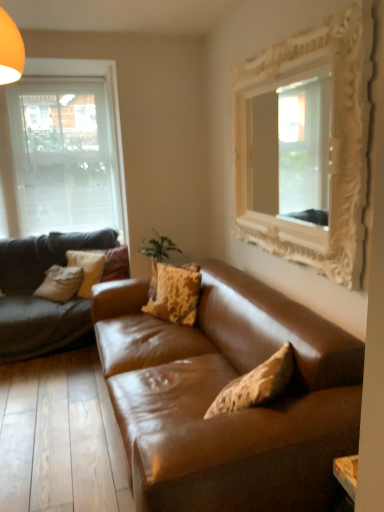
Question: Which is correct: brown leather couch at center is inside transparent glass window at left, or outside of it?

Choices:
 (A) outside
 (B) inside

Answer: (A)

Question: From the image's perspective, is brown leather couch at center above or below transparent glass window at left?

Choices:
 (A) below
 (B) above

Answer: (A)

Question: Which of these objects is positioned farthest from the camouflage-patterned fabric pillow at center, acting as the third pillow starting from the back?

Choices:
 (A) brown leather couch at center
 (B) camouflage-patterned fabric pillow at center-left, which ranks as the 1th pillow in left-to-right order
 (C) white ornate mirror at upper right
 (D) transparent glass window at left
 (E) camouflage-patterned fabric pillow at center, the second pillow positioned from the left

Answer: (D)

Question: Estimate the real-world distances between objects in this image. Which object is farther from the camouflage-patterned fabric pillow at center-left, the second pillow from the front?

Choices:
 (A) brown leather couch at center
 (B) camouflage-patterned fabric pillow at center, marked as the third pillow in a front-to-back arrangement
 (C) white ornate mirror at upper right
 (D) camouflage-patterned fabric pillow at center, the third pillow in the left-to-right sequence
 (E) transparent glass window at left

Answer: (C)